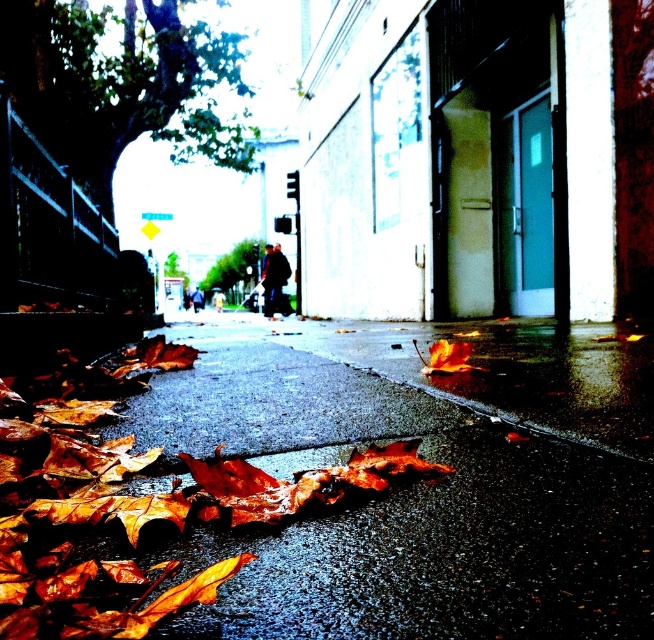
Question: Which of these objects is positioned closest to the brown rubber curb at lower center?

Choices:
 (A) green leafy tree at upper left
 (B) brown/dry leaves at center
 (C) green leafy tree at center

Answer: (B)

Question: Can you confirm if brown papery leaves at lower left is positioned to the right of brown rubber curb at lower center?

Choices:
 (A) no
 (B) yes

Answer: (A)

Question: Which of the following is the closest to the observer?

Choices:
 (A) (525, 356)
 (B) (583, 412)
 (C) (241, 502)

Answer: (C)

Question: Is brown papery leaves at lower left smaller than green leafy tree at upper left?

Choices:
 (A) no
 (B) yes

Answer: (B)

Question: Is brown papery leaves at lower left thinner than green leafy tree at center?

Choices:
 (A) yes
 (B) no

Answer: (A)

Question: Which object is closer to the camera taking this photo?

Choices:
 (A) brown/dry leaves at center
 (B) green leafy tree at center

Answer: (A)